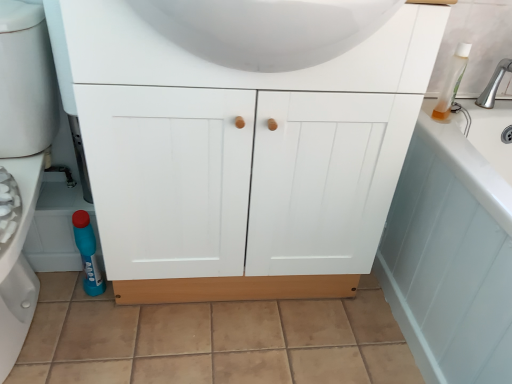
Question: Considering the relative positions of white glossy sink at upper center and beige ceramic tile at lower center in the image provided, is white glossy sink at upper center in front of beige ceramic tile at lower center?

Choices:
 (A) no
 (B) yes

Answer: (B)

Question: Can you confirm if white glossy sink at upper center is bigger than beige ceramic tile at lower center?

Choices:
 (A) yes
 (B) no

Answer: (A)

Question: Can you confirm if white glossy sink at upper center is smaller than beige ceramic tile at lower center?

Choices:
 (A) no
 (B) yes

Answer: (A)

Question: Would you say white glossy sink at upper center contains beige ceramic tile at lower center?

Choices:
 (A) no
 (B) yes

Answer: (A)

Question: Does white glossy sink at upper center turn towards beige ceramic tile at lower center?

Choices:
 (A) yes
 (B) no

Answer: (B)

Question: Is white glossy sink at upper center taller than beige ceramic tile at lower center?

Choices:
 (A) yes
 (B) no

Answer: (A)

Question: From the image's perspective, is blue plastic bottle at lower left beneath translucent plastic bottle at upper right?

Choices:
 (A) yes
 (B) no

Answer: (A)

Question: Is blue plastic bottle at lower left facing towards translucent plastic bottle at upper right?

Choices:
 (A) no
 (B) yes

Answer: (A)

Question: Would you consider blue plastic bottle at lower left to be distant from translucent plastic bottle at upper right?

Choices:
 (A) yes
 (B) no

Answer: (A)

Question: From the image's perspective, is blue plastic bottle at lower left above translucent plastic bottle at upper right?

Choices:
 (A) yes
 (B) no

Answer: (B)

Question: Would you say translucent plastic bottle at upper right is part of blue plastic bottle at lower left's contents?

Choices:
 (A) yes
 (B) no

Answer: (B)

Question: Can you confirm if blue plastic bottle at lower left is taller than translucent plastic bottle at upper right?

Choices:
 (A) yes
 (B) no

Answer: (A)

Question: Is light blue wood bath at lower right closer to camera compared to white matte cabinet at center?

Choices:
 (A) no
 (B) yes

Answer: (B)